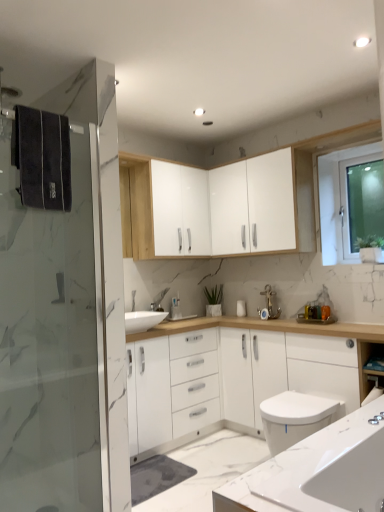
The width and height of the screenshot is (384, 512). Describe the element at coordinates (180, 210) in the screenshot. I see `white glossy cabinet at upper center, which is the 2th cabinetry in right-to-left order` at that location.

This screenshot has width=384, height=512. Find the location of `white marble countertop at lower right`. white marble countertop at lower right is located at coordinates (317, 471).

Where is `white glossy cabinet at lower right`? white glossy cabinet at lower right is located at coordinates (235, 375).

Where is `white glossy cabinet at upper center, which is the 2th cabinetry in right-to-left order`? white glossy cabinet at upper center, which is the 2th cabinetry in right-to-left order is located at coordinates (180, 210).

From the image's perspective, which is below, white glossy cabinet at lower right or transparent glass window at upper right?

white glossy cabinet at lower right appears lower in the image.

Looking at this image, does white glossy cabinet at lower right have a greater height compared to transparent glass window at upper right?

Yes, white glossy cabinet at lower right is taller than transparent glass window at upper right.

Based on their sizes in the image, would you say white glossy cabinet at lower right is bigger or smaller than transparent glass window at upper right?

Clearly, white glossy cabinet at lower right is larger in size than transparent glass window at upper right.

Are white glossy cabinet at lower right and transparent glass window at upper right located far from each other?

Absolutely, white glossy cabinet at lower right is distant from transparent glass window at upper right.

Consider the image. From a real-world perspective, between gold metallic faucet at center and white glossy cabinet at lower right, who is vertically lower?

white glossy cabinet at lower right is physically lower.

Is gold metallic faucet at center turned away from white glossy cabinet at lower right?

No.

From the image's perspective, who appears lower, gold metallic faucet at center or white glossy cabinet at lower right?

white glossy cabinet at lower right appears lower in the image.

Are gold metallic faucet at center and white glossy cabinet at lower right beside each other?

No, gold metallic faucet at center is not making contact with white glossy cabinet at lower right.

Does point (338, 482) come in front of point (256, 241)?

Yes.

Is white marble countertop at lower right far away from white glossy cabinet at upper center, positioned as the 2th cabinetry in left-to-right order?

That's right, there is a large distance between white marble countertop at lower right and white glossy cabinet at upper center, positioned as the 2th cabinetry in left-to-right order.

Which of these two, white marble countertop at lower right or white glossy cabinet at upper center, the first cabinetry from the right, is wider?

white marble countertop at lower right.

Which object is thinner, transparent glass window at upper right or white marble countertop at lower right?

Thinner between the two is transparent glass window at upper right.

From the image's perspective, is transparent glass window at upper right located above white marble countertop at lower right?

Yes.

From a real-world perspective, which is physically above, transparent glass window at upper right or white marble countertop at lower right?

transparent glass window at upper right, from a real-world perspective.

In the scene shown: Considering the relative sizes of transparent glass window at upper right and white marble countertop at lower right in the image provided, is transparent glass window at upper right bigger than white marble countertop at lower right?

No, transparent glass window at upper right is not bigger than white marble countertop at lower right.

Considering the sizes of white glossy cabinet at upper center, the 1th cabinetry when ordered from left to right, and transparent glass screen door at left in the image, is white glossy cabinet at upper center, the 1th cabinetry when ordered from left to right, bigger or smaller than transparent glass screen door at left?

In the image, white glossy cabinet at upper center, the 1th cabinetry when ordered from left to right, appears to be larger than transparent glass screen door at left.

Measure the distance between white glossy cabinet at upper center, the 1th cabinetry when ordered from left to right, and transparent glass screen door at left.

The distance of white glossy cabinet at upper center, the 1th cabinetry when ordered from left to right, from transparent glass screen door at left is 1.16 meters.

Is white glossy cabinet at upper center, the 1th cabinetry when ordered from left to right, not close to transparent glass screen door at left?

white glossy cabinet at upper center, the 1th cabinetry when ordered from left to right, is far away from transparent glass screen door at left.

Based on the photo, is white glossy cabinet at upper center, the 1th cabinetry when ordered from left to right, turned away from transparent glass screen door at left?

No, transparent glass screen door at left is not at the back of white glossy cabinet at upper center, the 1th cabinetry when ordered from left to right.

Is the depth of transparent glass window at upper right less than that of transparent glass screen door at left?

No.

From a real-world perspective, who is located lower, transparent glass window at upper right or transparent glass screen door at left?

From a 3D spatial view, transparent glass screen door at left is below.

Is transparent glass window at upper right oriented towards transparent glass screen door at left?

Yes, transparent glass window at upper right is turned towards transparent glass screen door at left.

Considering the relative sizes of transparent glass window at upper right and transparent glass screen door at left in the image provided, is transparent glass window at upper right taller than transparent glass screen door at left?

Incorrect, the height of transparent glass window at upper right is not larger of that of transparent glass screen door at left.

Where is `countertop on the right of white glossy cabinet at upper center, positioned as the 2th cabinetry in left-to-right order`? The height and width of the screenshot is (512, 384). countertop on the right of white glossy cabinet at upper center, positioned as the 2th cabinetry in left-to-right order is located at coordinates (317, 471).

From the image's perspective, who appears lower, white glossy cabinet at upper center, positioned as the 2th cabinetry in left-to-right order, or white marble countertop at lower right?

white marble countertop at lower right appears lower in the image.

Would you consider white glossy cabinet at upper center, positioned as the 2th cabinetry in left-to-right order, to be distant from white marble countertop at lower right?

white glossy cabinet at upper center, positioned as the 2th cabinetry in left-to-right order, is far away from white marble countertop at lower right.

Is white glossy cabinet at upper center, positioned as the 2th cabinetry in left-to-right order, oriented towards white marble countertop at lower right?

No, white glossy cabinet at upper center, positioned as the 2th cabinetry in left-to-right order, is not oriented towards white marble countertop at lower right.

You are a GUI agent. You are given a task and a screenshot of the screen. Output one action in this format:
    pyautogui.click(x=<x>, y=<y>)
    Task: Click on the bathroom cabinet beneath the transparent glass window at upper right (from a real-world perspective)
    
    Given the screenshot: What is the action you would take?
    pyautogui.click(x=235, y=375)

I want to click on faucet behind the white glossy cabinet at lower right, so click(270, 302).

From the image, which object appears to be nearer to white glossy cabinet at lower right, transparent glass screen door at left or transparent glass window at upper right?

transparent glass screen door at left is closer to white glossy cabinet at lower right.

Considering their positions, is white glossy cabinet at upper center, the first cabinetry from the right, positioned further to white glossy cabinet at upper center, which is the 2th cabinetry in right-to-left order, than white glossy cabinet at lower right?

Based on the image, white glossy cabinet at lower right appears to be further to white glossy cabinet at upper center, which is the 2th cabinetry in right-to-left order.

When comparing their distances from transparent glass window at upper right, does white glossy cabinet at upper center, the first cabinetry from the right, or white glossy cabinet at lower right seem closer?

The object closer to transparent glass window at upper right is white glossy cabinet at upper center, the first cabinetry from the right.

Looking at the image, which one is located further to white marble countertop at lower right, transparent glass window at upper right or transparent glass screen door at left?

transparent glass window at upper right lies further to white marble countertop at lower right than the other object.

Which object lies nearer to the anchor point white glossy cabinet at upper center, which is the 2th cabinetry in right-to-left order, transparent glass screen door at left or white glossy cabinet at upper center, the first cabinetry from the right?

white glossy cabinet at upper center, the first cabinetry from the right.

Estimate the real-world distances between objects in this image. Which object is closer to white glossy cabinet at lower right, white glossy cabinet at upper center, the first cabinetry from the right, or transparent glass screen door at left?

white glossy cabinet at upper center, the first cabinetry from the right, is positioned closer to the anchor white glossy cabinet at lower right.

Based on the photo, from the image, which object appears to be farther from white glossy cabinet at upper center, positioned as the 2th cabinetry in left-to-right order, white marble countertop at lower right or gold metallic faucet at center?

Result: white marble countertop at lower right lies further to white glossy cabinet at upper center, positioned as the 2th cabinetry in left-to-right order, than the other object.

Which object lies nearer to the anchor point gold metallic faucet at center, transparent glass screen door at left or white glossy cabinet at lower right?

Based on the image, white glossy cabinet at lower right appears to be nearer to gold metallic faucet at center.

Where is `bathroom cabinet between transparent glass screen door at left and transparent glass window at upper right in the horizontal direction`? Image resolution: width=384 pixels, height=512 pixels. bathroom cabinet between transparent glass screen door at left and transparent glass window at upper right in the horizontal direction is located at coordinates (235, 375).

I want to click on bathroom cabinet located between white marble countertop at lower right and white glossy cabinet at upper center, the 1th cabinetry when ordered from left to right, in the depth direction, so click(235, 375).

At what (x,y) coordinates should I click in order to perform the action: click on bathroom cabinet between white marble countertop at lower right and white glossy cabinet at upper center, the first cabinetry from the right, in the front-back direction. Please return your answer as a coordinate pair (x, y). The image size is (384, 512). Looking at the image, I should click on (235, 375).

Where is `faucet situated between white glossy cabinet at upper center, which is the 2th cabinetry in right-to-left order, and transparent glass window at upper right from left to right`? The width and height of the screenshot is (384, 512). faucet situated between white glossy cabinet at upper center, which is the 2th cabinetry in right-to-left order, and transparent glass window at upper right from left to right is located at coordinates (270, 302).